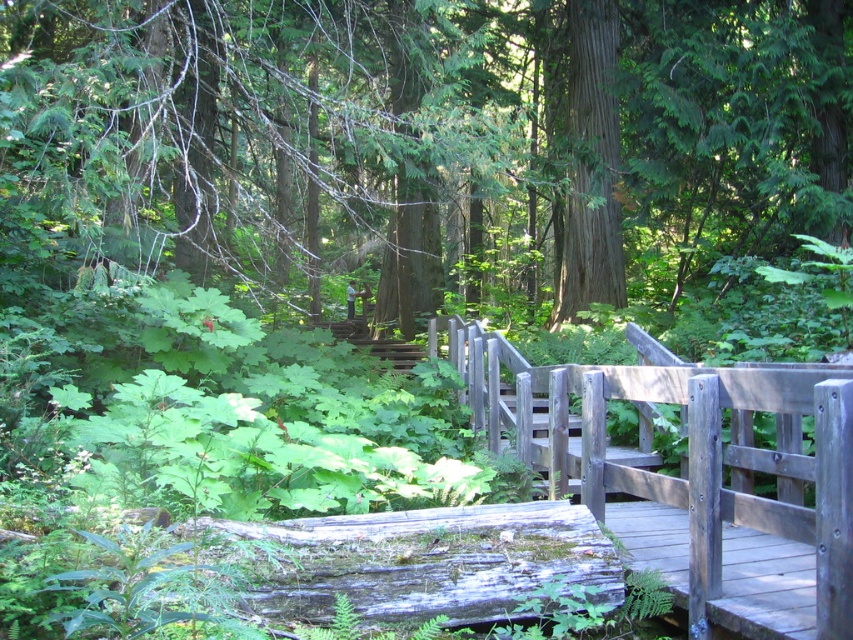
Question: Which point is farther from the camera taking this photo?

Choices:
 (A) click(102, 108)
 (B) click(630, 333)
 (C) click(569, 93)

Answer: (C)

Question: Considering the real-world distances, which object is farthest from the smooth brown tree trunk at upper center?

Choices:
 (A) smooth green tree at center
 (B) wooden bridge at center

Answer: (B)

Question: Can you confirm if wooden bridge at center is bigger than smooth brown tree trunk at upper center?

Choices:
 (A) yes
 (B) no

Answer: (B)

Question: Does wooden bridge at center appear under smooth brown tree trunk at upper center?

Choices:
 (A) no
 (B) yes

Answer: (B)

Question: Can you confirm if wooden bridge at center is positioned below smooth brown tree trunk at upper center?

Choices:
 (A) no
 (B) yes

Answer: (B)

Question: Which of the following is the closest to the observer?

Choices:
 (A) smooth green tree at center
 (B) smooth brown tree trunk at upper center

Answer: (A)